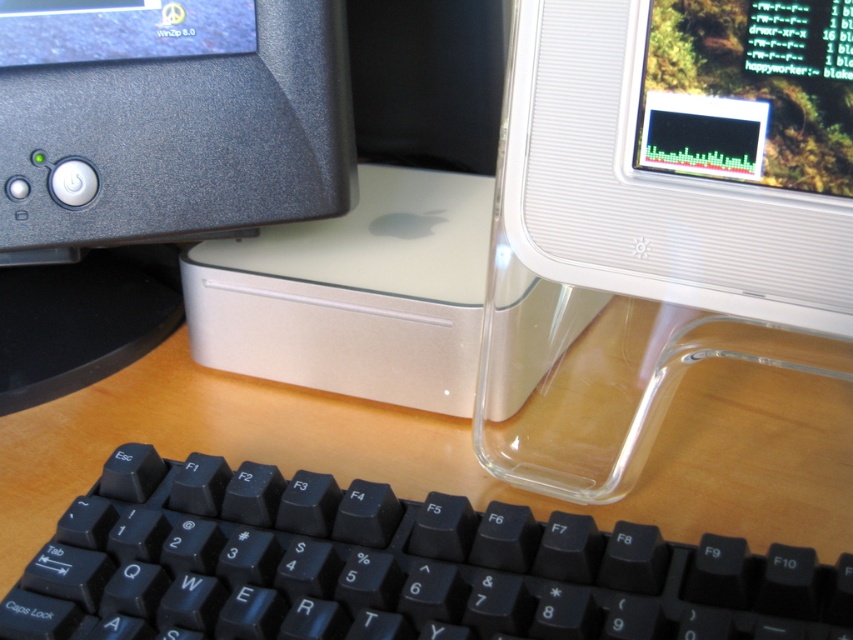
Question: Is black plastic keyboard at lower center thinner than transparent plastic screen at upper right?

Choices:
 (A) no
 (B) yes

Answer: (A)

Question: Which object is closer to the camera taking this photo?

Choices:
 (A) transparent plastic screen at upper right
 (B) black plastic keyboard at lower center
 (C) white textured monitor at upper right
 (D) matte black desktop computer at left

Answer: (B)

Question: Which point is farther to the camera?

Choices:
 (A) (386, 561)
 (B) (293, 200)
 (C) (512, 58)

Answer: (B)

Question: Can you confirm if white textured monitor at upper right is bigger than transparent plastic screen at upper right?

Choices:
 (A) no
 (B) yes

Answer: (B)

Question: Is black plastic keyboard at lower center bigger than matte black desktop computer at left?

Choices:
 (A) yes
 (B) no

Answer: (B)

Question: Considering the real-world distances, which object is closest to the matte black desktop computer at left?

Choices:
 (A) transparent plastic screen at upper right
 (B) black plastic keyboard at lower center

Answer: (B)